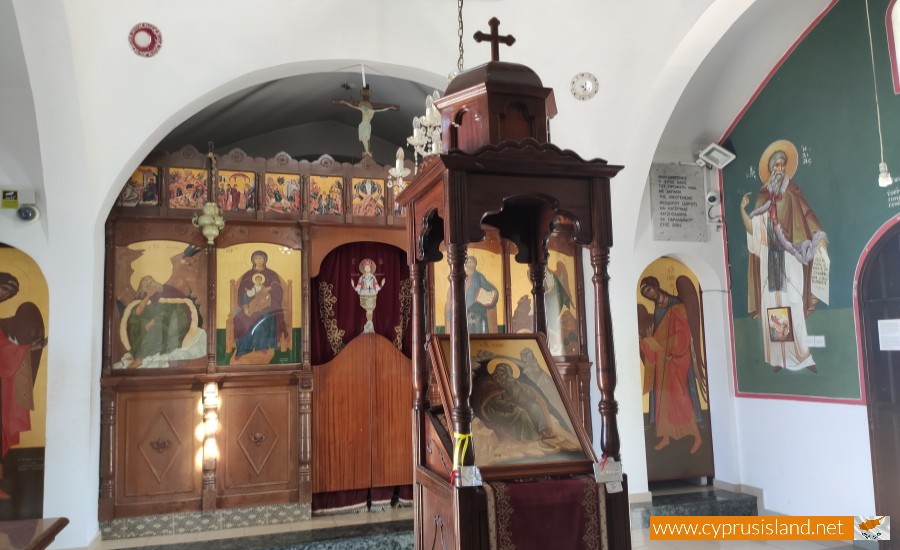
Identify the location of ceiling. This screenshot has width=900, height=550. tap(605, 26).